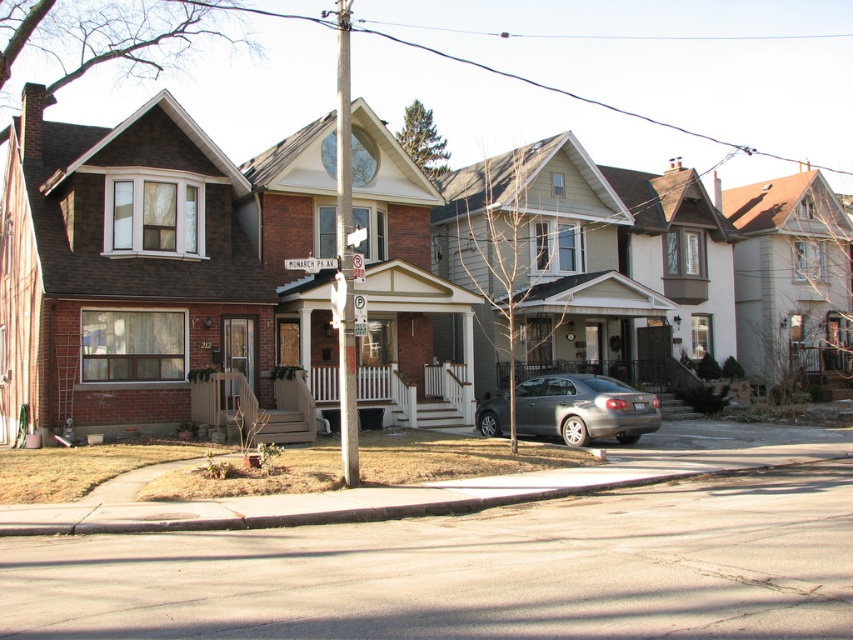
You are driving a car and see a wooden street sign at center and a satin silver sedan at center. Which object is closer to you?

The satin silver sedan at center is closer to you because the wooden street sign at center is behind it.

You are standing at the street level looking at the row of houses. There are two points marked in the image. One is at coordinate point (490, 486) and the other is at point (299, 257). Which of these two points is closer to you?

Point (490, 486) is closer to the viewer than point (299, 257).